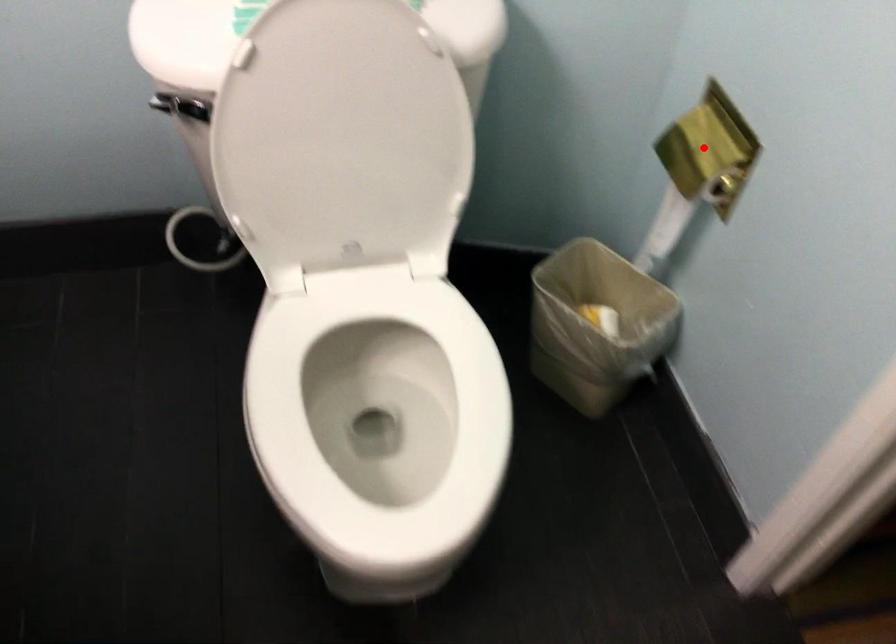
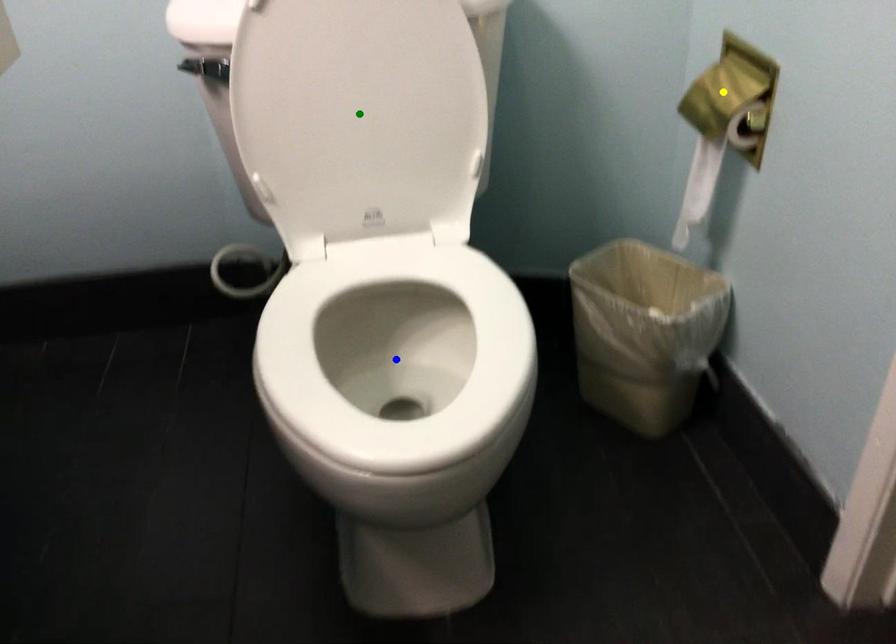
Question: I am providing you with two images of the same scene from different viewpoints. A red point is marked on the first image. You are given multiple points on the second image. Which point in image 2 is actually the same real-world point as the red point in image 1?

Choices:
 (A) green point
 (B) blue point
 (C) yellow point

Answer: (C)